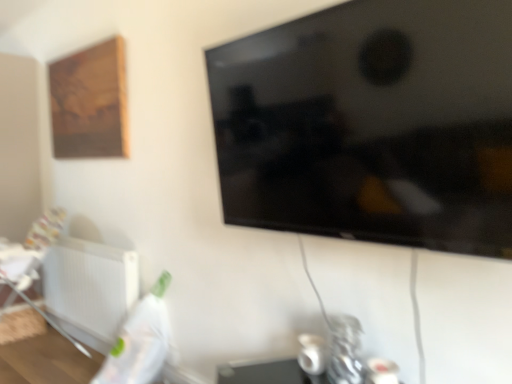
This screenshot has height=384, width=512. I want to click on white plastic radiator at lower left, so click(x=90, y=289).

This screenshot has height=384, width=512. I want to click on black glossy tv at upper center, so click(372, 125).

What do you see at coordinates (90, 102) in the screenshot?
I see `wooden picture frame at upper left` at bounding box center [90, 102].

You are a GUI agent. You are given a task and a screenshot of the screen. Output one action in this format:
    pyautogui.click(x=<x>, y=<y>)
    Task: Click on the white plastic radiator at lower left
    This screenshot has height=384, width=512.
    Given the screenshot: What is the action you would take?
    pyautogui.click(x=90, y=289)

Can you see white plastic radiator at lower left touching wooden picture frame at upper left?

They are not placed beside each other.

Does point (84, 299) come closer to viewer compared to point (115, 128)?

No, (84, 299) is behind (115, 128).

Is white plastic radiator at lower left turned away from wooden picture frame at upper left?

No.

Can you confirm if white plastic radiator at lower left is positioned to the right of wooden picture frame at upper left?

Indeed, white plastic radiator at lower left is positioned on the right side of wooden picture frame at upper left.

Is point (105, 121) farther from viewer compared to point (489, 223)?

Yes, it is.

Is wooden picture frame at upper left located outside black glossy tv at upper center?

wooden picture frame at upper left is positioned outside black glossy tv at upper center.

Considering the relative positions of wooden picture frame at upper left and black glossy tv at upper center in the image provided, is wooden picture frame at upper left in front of black glossy tv at upper center?

No, the depth of wooden picture frame at upper left is greater than that of black glossy tv at upper center.

Which of these two, black glossy tv at upper center or wooden picture frame at upper left, is thinner?

With smaller width is wooden picture frame at upper left.

Based on their sizes in the image, would you say black glossy tv at upper center is bigger or smaller than wooden picture frame at upper left?

black glossy tv at upper center is bigger than wooden picture frame at upper left.

From a real-world perspective, does black glossy tv at upper center stand above wooden picture frame at upper left?

No, from a real-world perspective, black glossy tv at upper center is not on top of wooden picture frame at upper left.

Between black glossy tv at upper center and white plastic radiator at lower left, which one appears on the right side from the viewer's perspective?

From the viewer's perspective, black glossy tv at upper center appears more on the right side.

Is black glossy tv at upper center outside of white plastic radiator at lower left?

Absolutely, black glossy tv at upper center is external to white plastic radiator at lower left.

What are the coordinates of `television that is above the white plastic radiator at lower left (from the image's perspective)` in the screenshot? It's located at (372, 125).

From the image's perspective, between black glossy tv at upper center and white plastic radiator at lower left, who is located below?

white plastic radiator at lower left is shown below in the image.

From a real-world perspective, is wooden picture frame at upper left physically located above or below white plastic radiator at lower left?

From a real-world perspective, wooden picture frame at upper left is physically above white plastic radiator at lower left.

From the image's perspective, which object appears higher, wooden picture frame at upper left or white plastic radiator at lower left?

wooden picture frame at upper left is shown above in the image.

From the picture: Is wooden picture frame at upper left wider or thinner than white plastic radiator at lower left?

Considering their sizes, wooden picture frame at upper left looks slimmer than white plastic radiator at lower left.

From the picture: Can you tell me how much wooden picture frame at upper left and white plastic radiator at lower left differ in facing direction?

0.952 degrees.

Looking at this image, would you say black glossy tv at upper center is part of white plastic radiator at lower left's contents?

No, black glossy tv at upper center is not a part of white plastic radiator at lower left.

Who is bigger, white plastic radiator at lower left or black glossy tv at upper center?

black glossy tv at upper center.

From the image's perspective, relative to black glossy tv at upper center, is white plastic radiator at lower left above or below?

white plastic radiator at lower left is situated lower than black glossy tv at upper center in the image.

How different are the orientations of white plastic radiator at lower left and black glossy tv at upper center in degrees?

The facing directions of white plastic radiator at lower left and black glossy tv at upper center are 0.000149 degrees apart.

At what (x,y) coordinates should I click in order to perform the action: click on radiator in front of the wooden picture frame at upper left. Please return your answer as a coordinate pair (x, y). Looking at the image, I should click on (90, 289).

You are a GUI agent. You are given a task and a screenshot of the screen. Output one action in this format:
    pyautogui.click(x=<x>, y=<y>)
    Task: Click on the television on the right of wooden picture frame at upper left
    
    Given the screenshot: What is the action you would take?
    pyautogui.click(x=372, y=125)

From the image, which object appears to be nearer to white plastic radiator at lower left, wooden picture frame at upper left or black glossy tv at upper center?

wooden picture frame at upper left is positioned closer to the anchor white plastic radiator at lower left.

Based on their spatial positions, is black glossy tv at upper center or white plastic radiator at lower left closer to wooden picture frame at upper left?

Among the two, white plastic radiator at lower left is located nearer to wooden picture frame at upper left.

When comparing their distances from black glossy tv at upper center, does wooden picture frame at upper left or white plastic radiator at lower left seem closer?

wooden picture frame at upper left.

Based on their spatial positions, is white plastic radiator at lower left or wooden picture frame at upper left closer to black glossy tv at upper center?

wooden picture frame at upper left is closer to black glossy tv at upper center.

Considering their positions, is black glossy tv at upper center positioned closer to white plastic radiator at lower left than wooden picture frame at upper left?

wooden picture frame at upper left is closer to white plastic radiator at lower left.

From the image, which object appears to be nearer to wooden picture frame at upper left, white plastic radiator at lower left or black glossy tv at upper center?

Based on the image, white plastic radiator at lower left appears to be nearer to wooden picture frame at upper left.

Locate an element on the screen. The image size is (512, 384). radiator between black glossy tv at upper center and wooden picture frame at upper left along the z-axis is located at coordinates (90, 289).